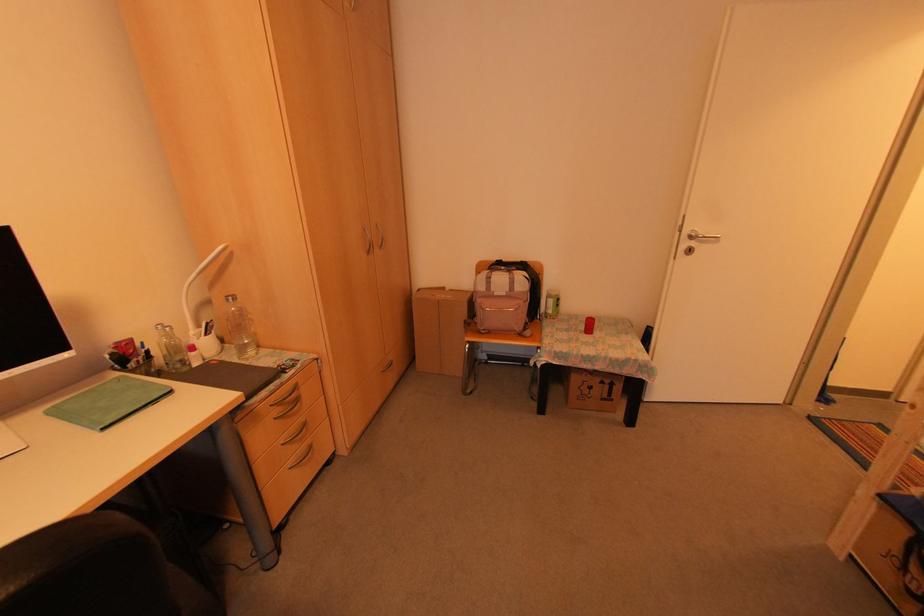
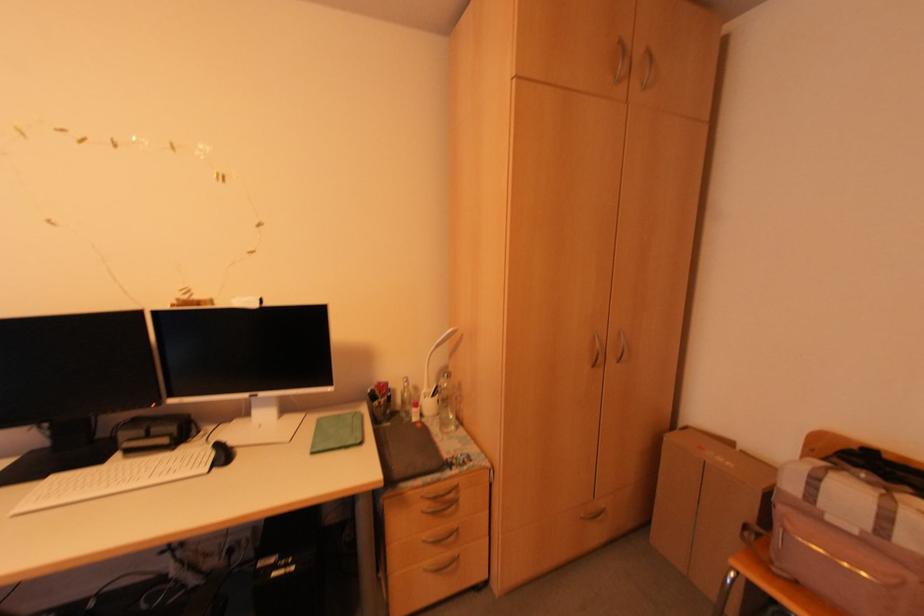
Question: The camera is either moving clockwise (left) or counter-clockwise (right) around the object. The first image is from the beginning of the video and the second image is from the end. Is the camera moving left or right when shooting the video?

Choices:
 (A) Left
 (B) Right

Answer: (B)